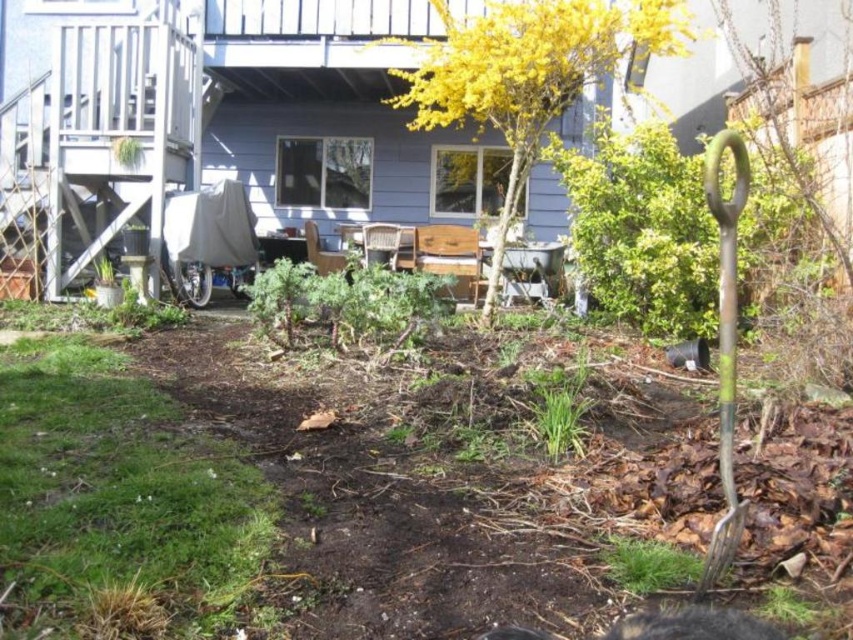
Question: Does yellow leafy plant at upper center have a larger size compared to rusty metal shovel at right?

Choices:
 (A) yes
 (B) no

Answer: (A)

Question: Among these objects, which one is nearest to the camera?

Choices:
 (A) yellow leafy plant at upper center
 (B) rusty metal shovel at right

Answer: (B)

Question: Where is yellow leafy plant at upper center located in relation to rusty metal shovel at right in the image?

Choices:
 (A) above
 (B) below

Answer: (A)

Question: Is yellow leafy plant at upper center closer to the viewer compared to rusty metal shovel at right?

Choices:
 (A) yes
 (B) no

Answer: (B)

Question: Which of the following is the farthest from the observer?

Choices:
 (A) rusty metal shovel at right
 (B) yellow leafy plant at upper center

Answer: (B)